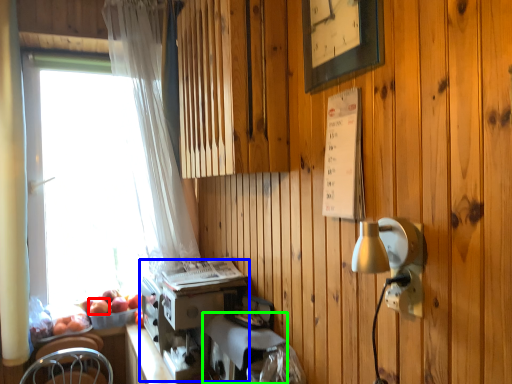
Question: Based on their relative distances, which object is farther from apple (highlighted by a red box)? Choose from coffee machine (highlighted by a blue box) and appliance (highlighted by a green box).

Choices:
 (A) coffee machine
 (B) appliance

Answer: (B)